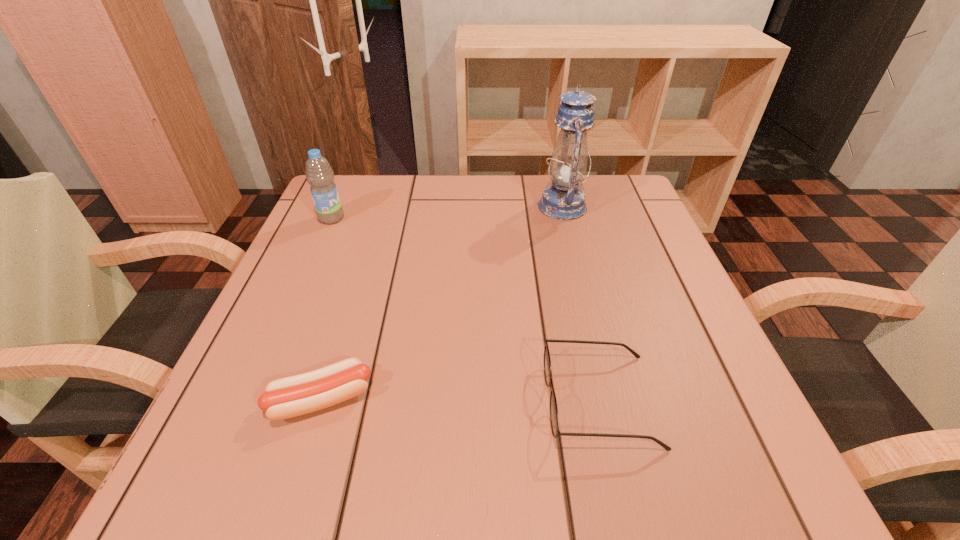
The image size is (960, 540). What are the coordinates of `vacant area that lies between the shortest object and the spectacles` in the screenshot? It's located at pos(461,400).

The image size is (960, 540). Identify the location of free space between the lantern and the spectacles. (581, 303).

You are a GUI agent. You are given a task and a screenshot of the screen. Output one action in this format:
    pyautogui.click(x=<x>, y=<y>)
    Task: Click on the free space between the third tallest object and the lantern
    The width and height of the screenshot is (960, 540).
    Given the screenshot: What is the action you would take?
    pyautogui.click(x=581, y=303)

Find the location of a particular element. The image size is (960, 540). free space between the sausage and the water bottle is located at coordinates (326, 309).

Find the location of a particular element. This screenshot has height=540, width=960. vacant area that lies between the sausage and the second shortest object is located at coordinates (461, 400).

Find the location of a particular element. empty space between the spectacles and the shortest object is located at coordinates (461, 400).

Where is `vacant area between the tallest object and the sausage`? Image resolution: width=960 pixels, height=540 pixels. vacant area between the tallest object and the sausage is located at coordinates (442, 303).

Where is `object that stands as the second closest to the tallest object`? This screenshot has width=960, height=540. object that stands as the second closest to the tallest object is located at coordinates (319, 174).

What are the coordinates of `the third closest object to the tallest object` in the screenshot? It's located at [x=288, y=397].

This screenshot has width=960, height=540. Identify the location of vacant space that satisfies the following two spatial constraints: 1. on the front-facing side of the tallest object; 2. on the front side of the shortest object. (611, 399).